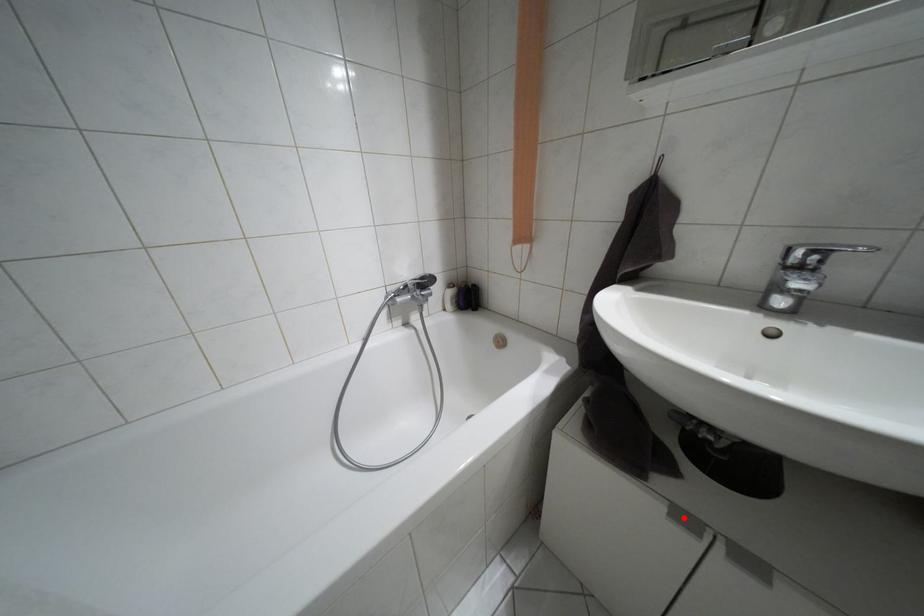
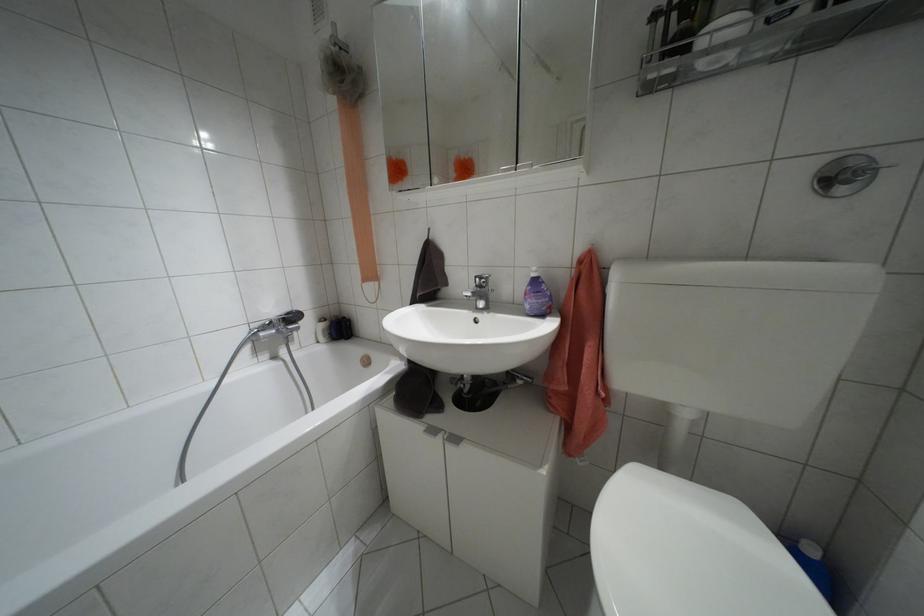
Find the pixel in the second image that matches the highlighted location in the first image.

(432, 430)